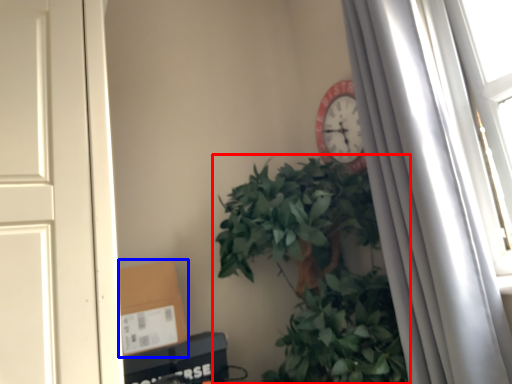
Question: Which point is closer to the camera, houseplant (highlighted by a red box) or cardboard box (highlighted by a blue box)?

Choices:
 (A) houseplant
 (B) cardboard box

Answer: (A)